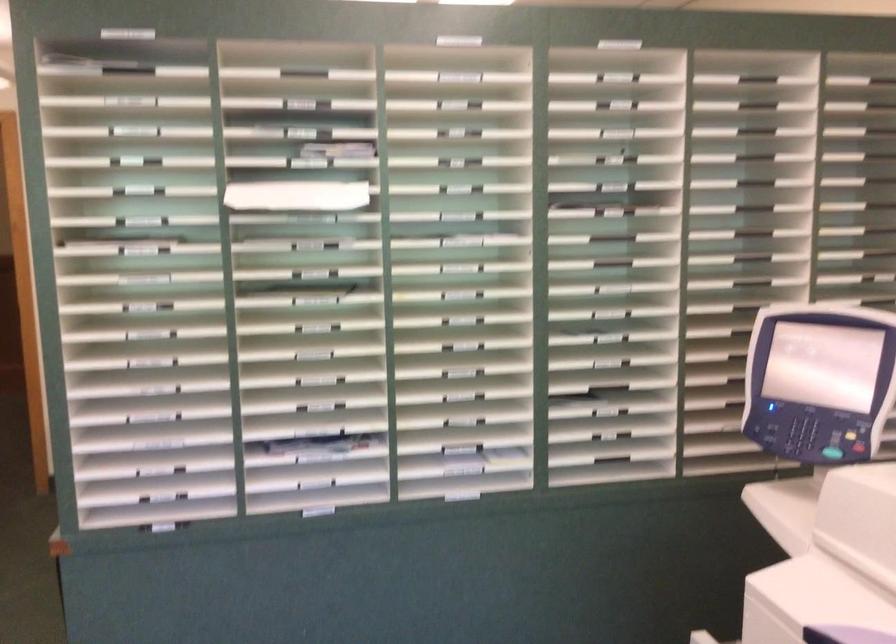
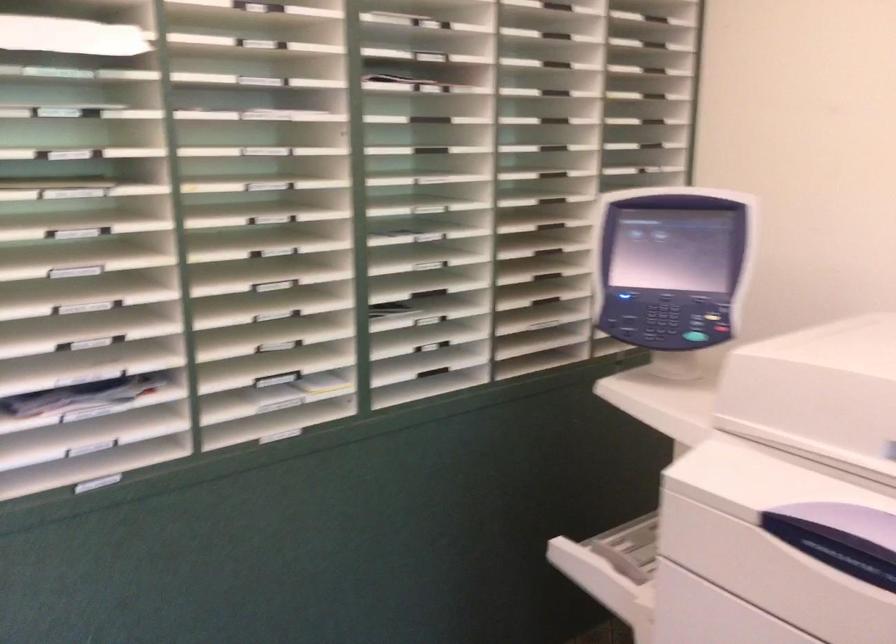
In a continuous first-person perspective shot, in which direction is the camera moving?

The movement direction of the cameraman is left, forward.